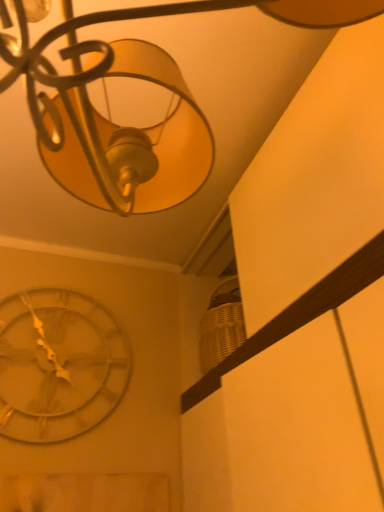
Question: Considering the relative positions of metallic gold lampshade at upper center and metallic silver clock at lower left in the image provided, is metallic gold lampshade at upper center to the left or to the right of metallic silver clock at lower left?

Choices:
 (A) left
 (B) right

Answer: (B)

Question: From the image's perspective, relative to metallic silver clock at lower left, is metallic gold lampshade at upper center above or below?

Choices:
 (A) above
 (B) below

Answer: (A)

Question: From their relative heights in the image, would you say metallic gold lampshade at upper center is taller or shorter than metallic silver clock at lower left?

Choices:
 (A) short
 (B) tall

Answer: (B)

Question: Is metallic silver clock at lower left taller or shorter than metallic gold lampshade at upper center?

Choices:
 (A) tall
 (B) short

Answer: (B)

Question: Does point (66, 294) appear closer or farther from the camera than point (175, 116)?

Choices:
 (A) closer
 (B) farther

Answer: (B)

Question: In terms of width, does metallic silver clock at lower left look wider or thinner when compared to metallic gold lampshade at upper center?

Choices:
 (A) wide
 (B) thin

Answer: (B)

Question: From the image's perspective, is metallic silver clock at lower left above or below metallic gold lampshade at upper center?

Choices:
 (A) below
 (B) above

Answer: (A)